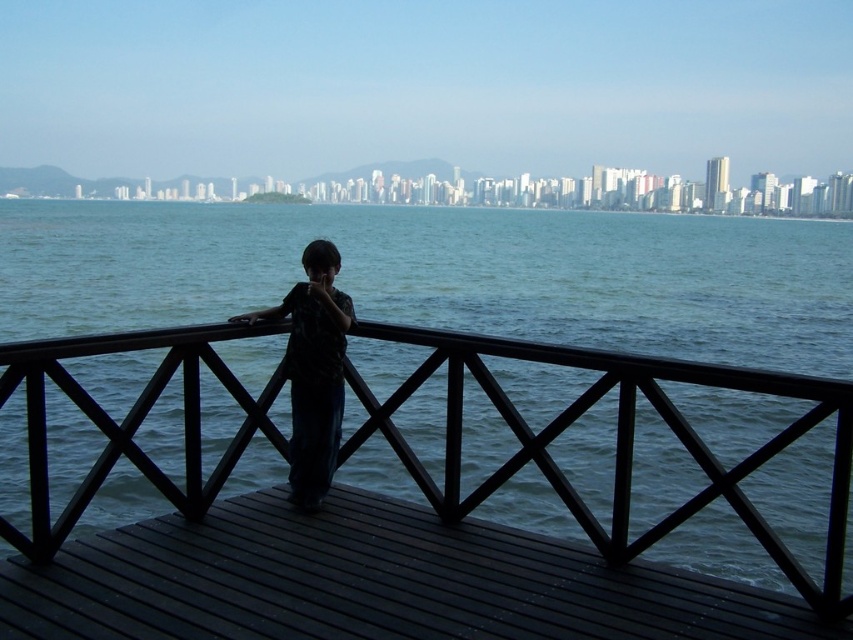
You are standing on the wooden deck and want to take a photo of the blue water at center. However, you notice the dark fabric shirt at center might be blocking your view. Based on their positions, can you determine if the shirt is in the way of the water?

The blue water at center is to the left of the dark fabric shirt at center, so the shirt is positioned to the right of the water. Since you are on the deck, the shirt would be blocking your view of the water if you are facing the same direction as the shirt. However, if you shift your position slightly to the left, you can capture the water without the shirt obstructing the view.